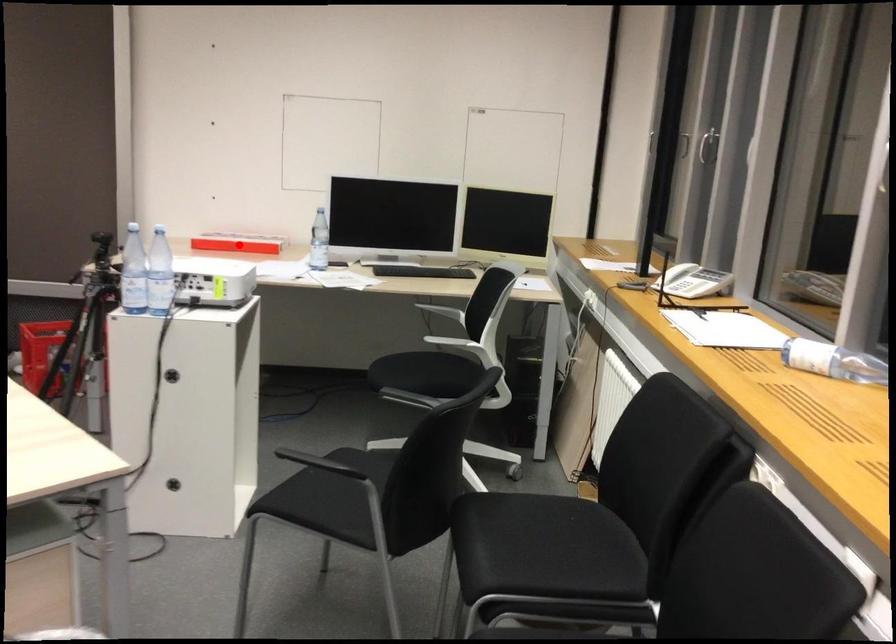
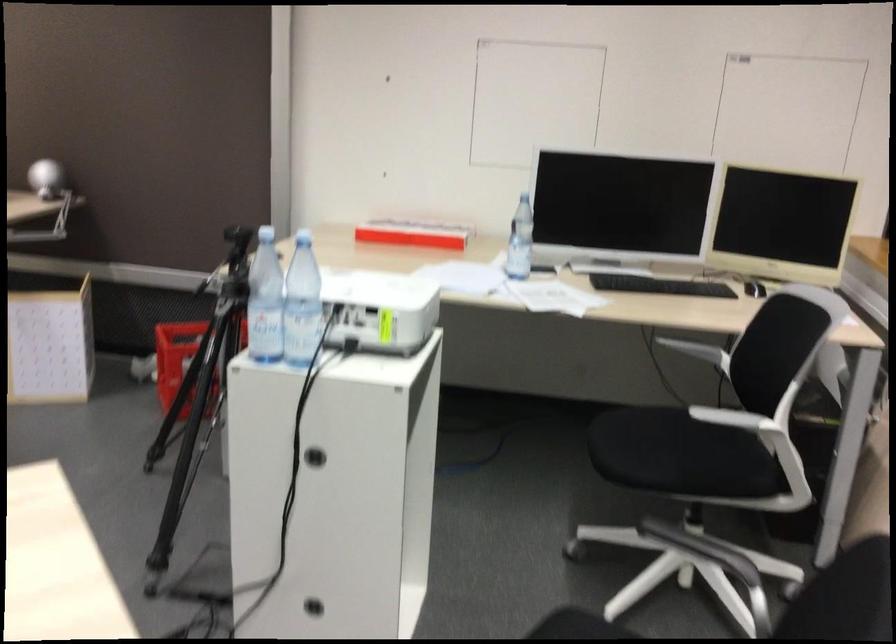
Question: I am providing you with two images of the same scene from different viewpoints. A red point is shown in image1. For the corresponding object point in image2, is it positioned nearer or farther from the camera?

Choices:
 (A) Nearer
 (B) Farther

Answer: (A)